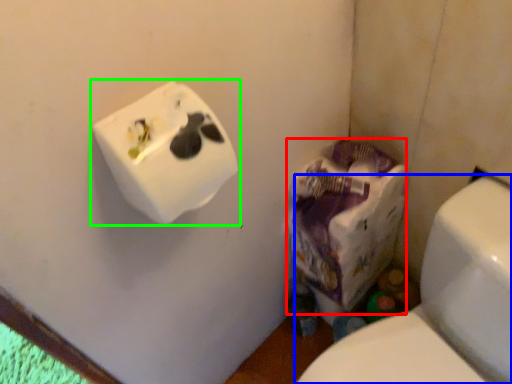
Question: Which is farther away from paper bag (highlighted by a red box)? toilet (highlighted by a blue box) or toilet paper (highlighted by a green box)?

Choices:
 (A) toilet
 (B) toilet paper

Answer: (B)